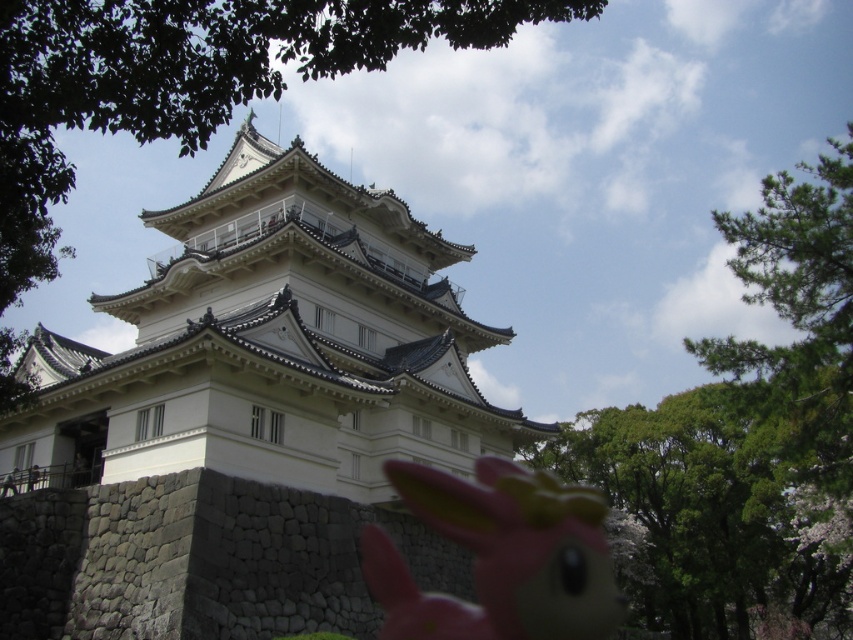
Question: Which object is closer to the camera taking this photo?

Choices:
 (A) pink rubber toy at center
 (B) green leafy tree at upper center

Answer: (B)

Question: In this image, where is green leafy tree at upper right located relative to green leafy tree at upper center?

Choices:
 (A) right
 (B) left

Answer: (A)

Question: Does green leafy tree at upper center have a lesser width compared to pink rubber toy at center?

Choices:
 (A) yes
 (B) no

Answer: (B)

Question: Which object is farther from the camera taking this photo?

Choices:
 (A) green leafy tree at upper right
 (B) green leafy tree at upper center

Answer: (A)

Question: Which object is closer to the camera taking this photo?

Choices:
 (A) pink rubber toy at center
 (B) green leafy tree at upper center
 (C) green leafy tree at upper right

Answer: (B)

Question: Is green leafy tree at upper center in front of pink rubber toy at center?

Choices:
 (A) yes
 (B) no

Answer: (A)